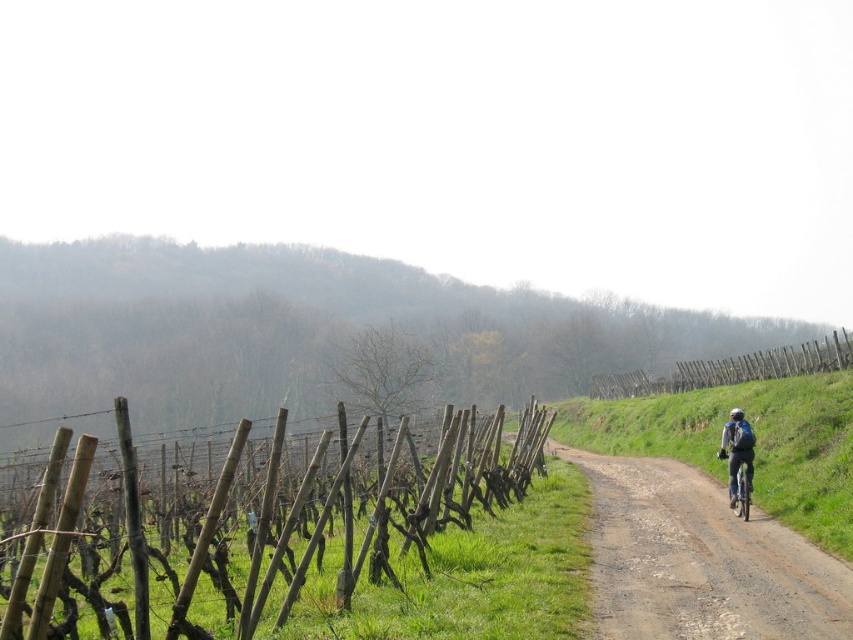
You are standing at the camera position and want to reach the point at coordinates (758, 598). The path is 1 meter wide. Can you walk straight to the point without stepping off the path?

The point at coordinates (758, 598) is 9.65 meters away from the camera. Since the path is 1 meter wide, you can walk straight to the point without stepping off the path as long as you stay within the path width.